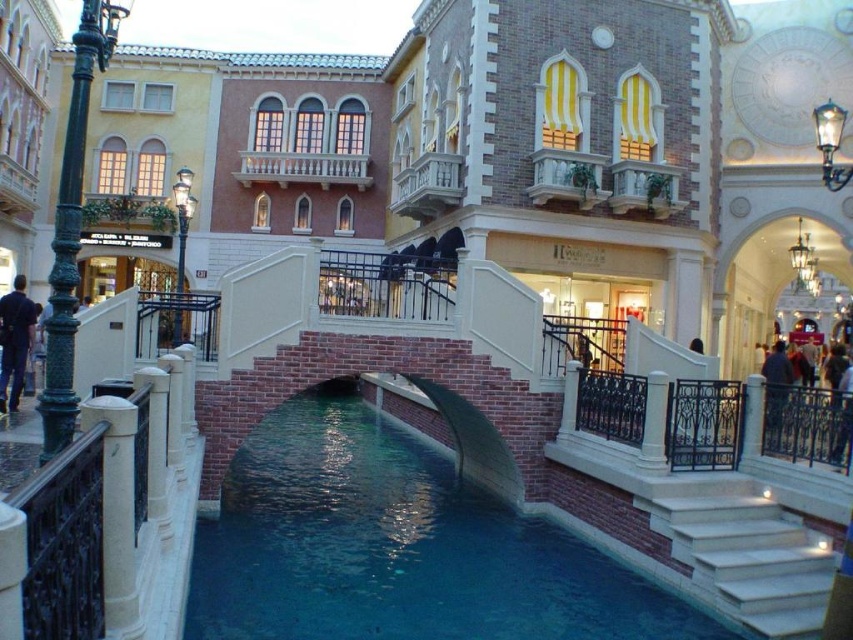
Between blue smooth water at center and dark blue fabric jacket at lower left, which one appears on the right side from the viewer's perspective?

Positioned to the right is blue smooth water at center.

Who is more distant from viewer, (583,632) or (15,387)?

Point (15,387)

Between point (207, 532) and point (9, 346), which one is positioned in front?

Positioned in front is point (207, 532).

Identify the location of blue smooth water at center. The width and height of the screenshot is (853, 640). (397, 550).

Is white marble stairs at lower right taller than dark blue fabric jacket at lower left?

No, white marble stairs at lower right is not taller than dark blue fabric jacket at lower left.

Between point (780, 548) and point (27, 353), which one is positioned in front?

Point (780, 548) is more forward.

Does point (781, 580) come farther from viewer compared to point (3, 387)?

That is False.

The width and height of the screenshot is (853, 640). In order to click on white marble stairs at lower right in this screenshot , I will do `click(718, 538)`.

Is blue smooth water at center further to camera compared to white marble stairs at lower right?

No, it is not.

Between blue smooth water at center and white marble stairs at lower right, which one is positioned higher?

white marble stairs at lower right is higher up.

What do you see at coordinates (397, 550) in the screenshot? Image resolution: width=853 pixels, height=640 pixels. I see `blue smooth water at center` at bounding box center [397, 550].

In order to click on blue smooth water at center in this screenshot , I will do `click(397, 550)`.